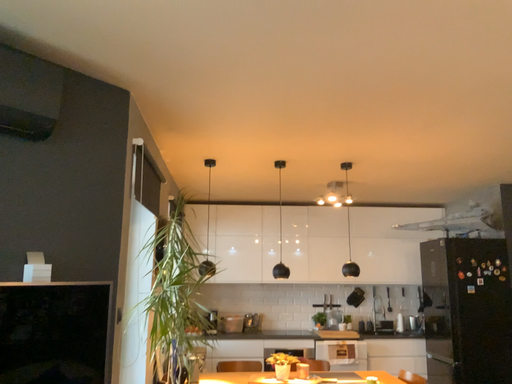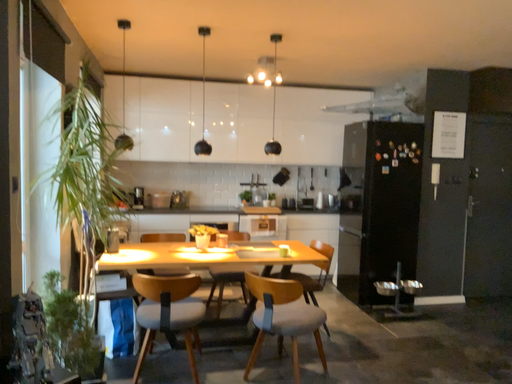
Question: How did the camera likely rotate when shooting the video?

Choices:
 (A) rotated left
 (B) rotated right

Answer: (B)